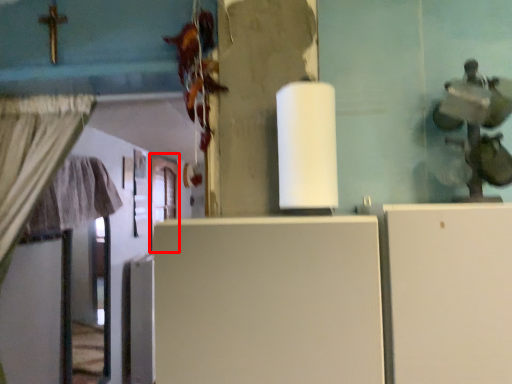
Question: From the image's perspective, what is the correct spatial relationship of door (annotated by the red box) in relation to fridge?

Choices:
 (A) above
 (B) below

Answer: (A)